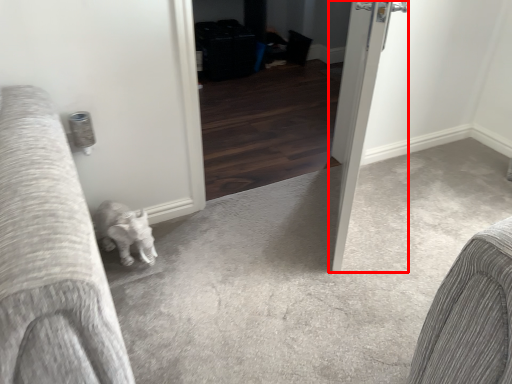
Question: In this image, where is door (annotated by the red box) located relative to screen door?

Choices:
 (A) right
 (B) left

Answer: (A)